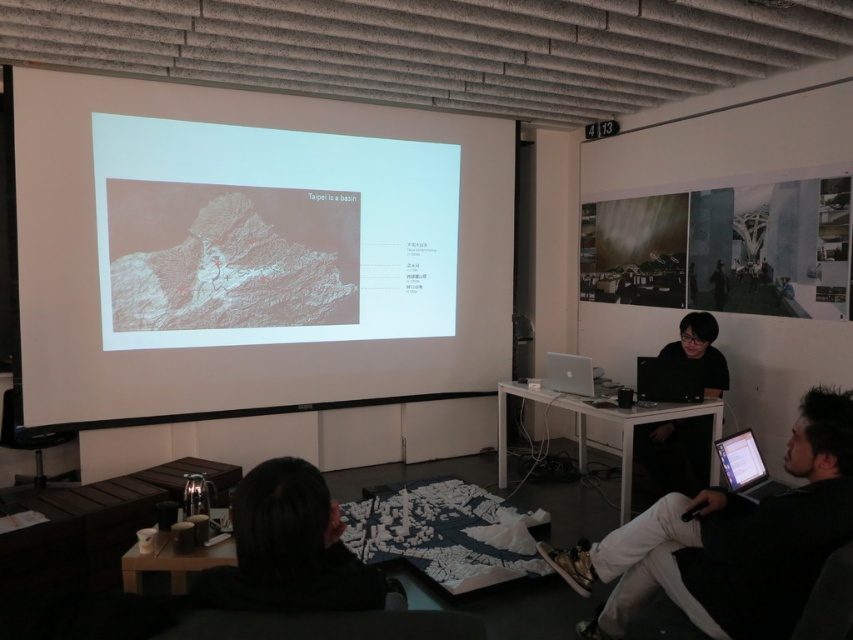
You are organizing a small event in the room and need to place a 12 inch wide decorative plate between the black fabric at lower center and the silver metallic laptop at lower right. Can the plate fit between them without overlapping either object?

The black fabric at lower center has a lesser width compared to silver metallic laptop at lower right. Since the plate is 12 inches wide, but the exact distance between them isn

Looking at this image, you are standing in the presentation room facing the projection screen. Where is the matte glass photo at upper right located relative to you?

The matte glass photo at upper right is located to your upper right side at point coordinates of (722, 250).